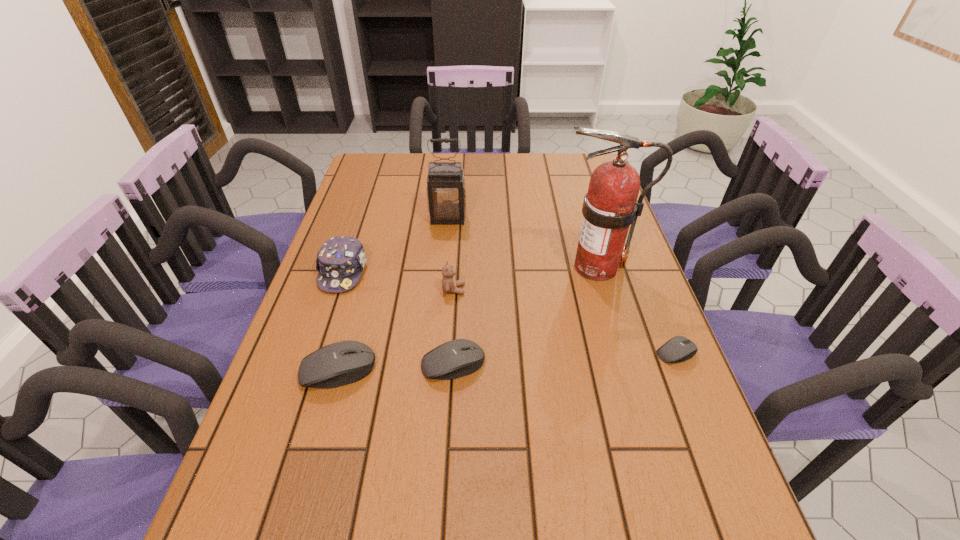
The height and width of the screenshot is (540, 960). I want to click on the leftmost computer equipment, so click(x=344, y=362).

Locate an element on the screen. the second computer equipment from right to left is located at coordinates (460, 357).

Identify the location of the second tallest computer equipment. (460, 357).

Where is `the rightmost computer equipment`? the rightmost computer equipment is located at coordinates (678, 349).

Where is `the shortest computer equipment`? This screenshot has height=540, width=960. the shortest computer equipment is located at coordinates (678, 349).

The height and width of the screenshot is (540, 960). Find the location of `lantern`. lantern is located at coordinates (446, 189).

You are a GUI agent. You are given a task and a screenshot of the screen. Output one action in this format:
    pyautogui.click(x=<x>, y=<y>)
    Task: Click on the farthest object
    The image size is (960, 540).
    Given the screenshot: What is the action you would take?
    pyautogui.click(x=446, y=189)

Find the location of a particular element. The height and width of the screenshot is (540, 960). headwear is located at coordinates point(340,261).

The width and height of the screenshot is (960, 540). Identify the location of teddy bear. (449, 284).

Locate an element on the screen. This screenshot has height=540, width=960. fire extinguisher is located at coordinates (610, 206).